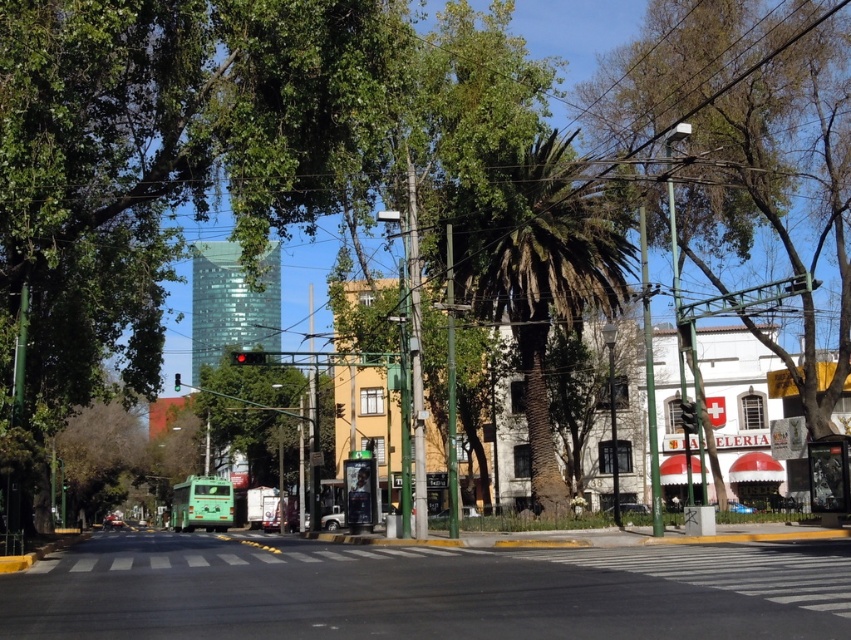
You are a delivery drone flying over the urban street scene. You need to land on the black asphalt road at center. According to the coordinates provided, where exactly should you aim to land?

The black asphalt road at center is located at point (423, 589), so you should aim for those coordinates to land safely.

You are a pedestrian standing at the edge of the road and want to cross to the other side. There is a metallic silver car at center and a green matte truck at center in your path. Which vehicle should you avoid first when crossing the road?

You should avoid the green matte truck at center first because the metallic silver car at center is to the right of it, meaning the truck is closer to your starting position on the left side of the road.

You are a delivery drone flying above the urban street scene. You need to land on the black asphalt road at center. What are the coordinates where you should land?

The coordinates for the black asphalt road at center are point [423,589].